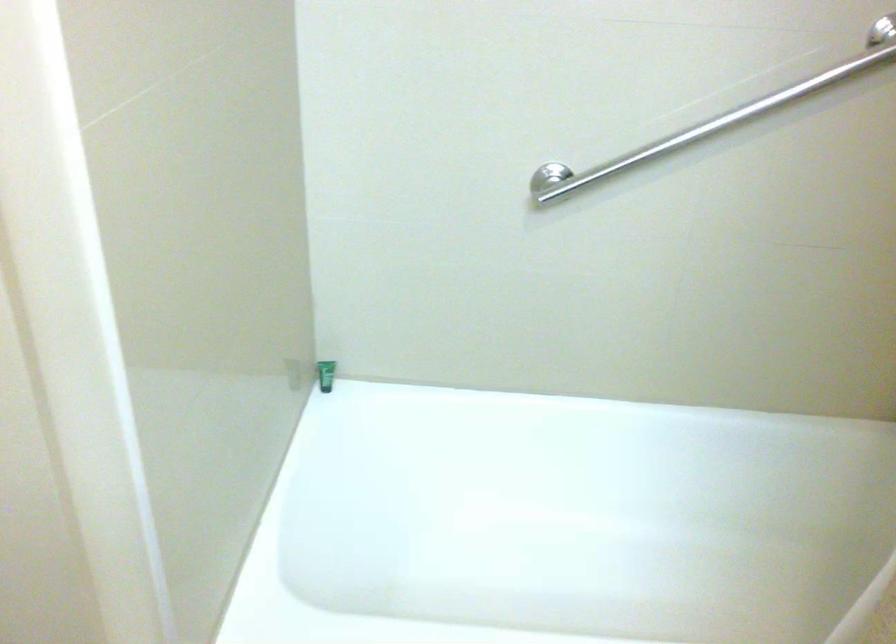
What do you see at coordinates (717, 120) in the screenshot? I see `a metal grab bar` at bounding box center [717, 120].